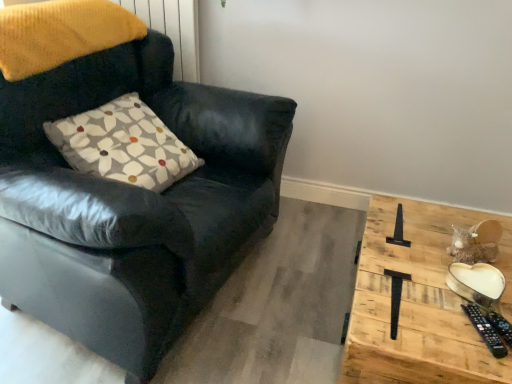
Question: Considering the relative positions of matte black armchair at left and wooden heart-shaped plate at right in the image provided, is matte black armchair at left to the left of wooden heart-shaped plate at right from the viewer's perspective?

Choices:
 (A) no
 (B) yes

Answer: (B)

Question: Are matte black armchair at left and wooden heart-shaped plate at right located far from each other?

Choices:
 (A) yes
 (B) no

Answer: (B)

Question: Is matte black armchair at left positioned with its back to wooden heart-shaped plate at right?

Choices:
 (A) no
 (B) yes

Answer: (A)

Question: From the image's perspective, is matte black armchair at left located beneath wooden heart-shaped plate at right?

Choices:
 (A) no
 (B) yes

Answer: (A)

Question: Does matte black armchair at left have a lesser height compared to wooden heart-shaped plate at right?

Choices:
 (A) no
 (B) yes

Answer: (A)

Question: Is wooden heart-shaped plate at right situated inside white printed cushion at upper left or outside?

Choices:
 (A) inside
 (B) outside

Answer: (B)

Question: In the image, is wooden heart-shaped plate at right positioned in front of or behind white printed cushion at upper left?

Choices:
 (A) front
 (B) behind

Answer: (A)

Question: From a real-world perspective, relative to white printed cushion at upper left, is wooden heart-shaped plate at right vertically above or below?

Choices:
 (A) below
 (B) above

Answer: (A)

Question: From the image's perspective, is wooden heart-shaped plate at right positioned above or below white printed cushion at upper left?

Choices:
 (A) below
 (B) above

Answer: (A)

Question: From a real-world perspective, is white printed cushion at upper left above or below matte black armchair at left?

Choices:
 (A) below
 (B) above

Answer: (B)

Question: From their relative heights in the image, would you say white printed cushion at upper left is taller or shorter than matte black armchair at left?

Choices:
 (A) short
 (B) tall

Answer: (A)

Question: From the image's perspective, relative to matte black armchair at left, is white printed cushion at upper left above or below?

Choices:
 (A) below
 (B) above

Answer: (B)

Question: Looking at their shapes, would you say white printed cushion at upper left is wider or thinner than matte black armchair at left?

Choices:
 (A) wide
 (B) thin

Answer: (B)

Question: In terms of width, does white printed cushion at upper left look wider or thinner when compared to wooden heart-shaped plate at right?

Choices:
 (A) thin
 (B) wide

Answer: (A)

Question: From a real-world perspective, relative to wooden heart-shaped plate at right, is white printed cushion at upper left vertically above or below?

Choices:
 (A) above
 (B) below

Answer: (A)